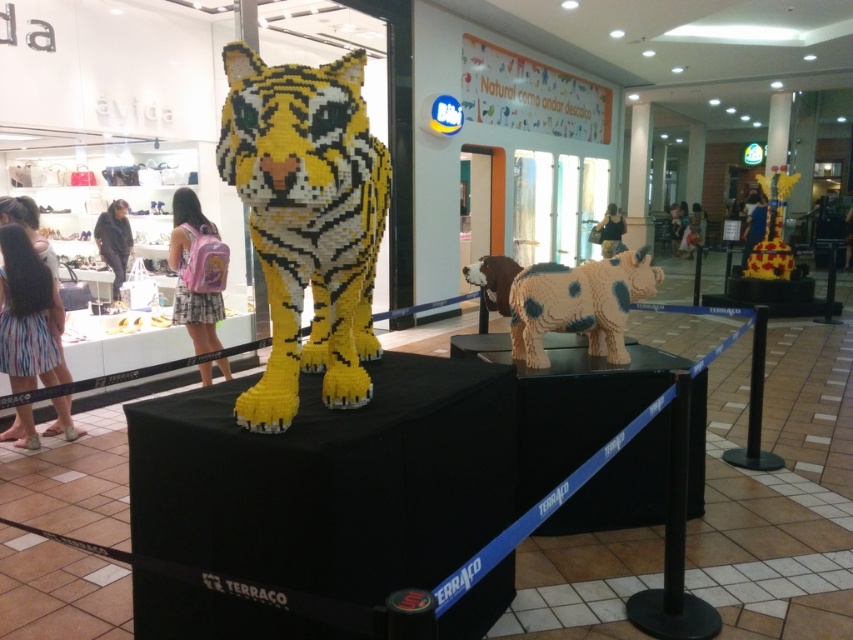
Question: Which point is closer to the camera?

Choices:
 (A) (654, 280)
 (B) (325, 380)

Answer: (B)

Question: Among these objects, which one is nearest to the camera?

Choices:
 (A) yellow lego tiger at center
 (B) speckled plastic cow at center

Answer: (A)

Question: Can you confirm if yellow lego tiger at center is positioned to the left of speckled plastic cow at center?

Choices:
 (A) no
 (B) yes

Answer: (B)

Question: Which object is farther from the camera taking this photo?

Choices:
 (A) speckled plastic cow at center
 (B) yellow lego tiger at center

Answer: (A)

Question: Can you confirm if yellow lego tiger at center is bigger than speckled plastic cow at center?

Choices:
 (A) no
 (B) yes

Answer: (B)

Question: Is yellow lego tiger at center wider than speckled plastic cow at center?

Choices:
 (A) yes
 (B) no

Answer: (B)